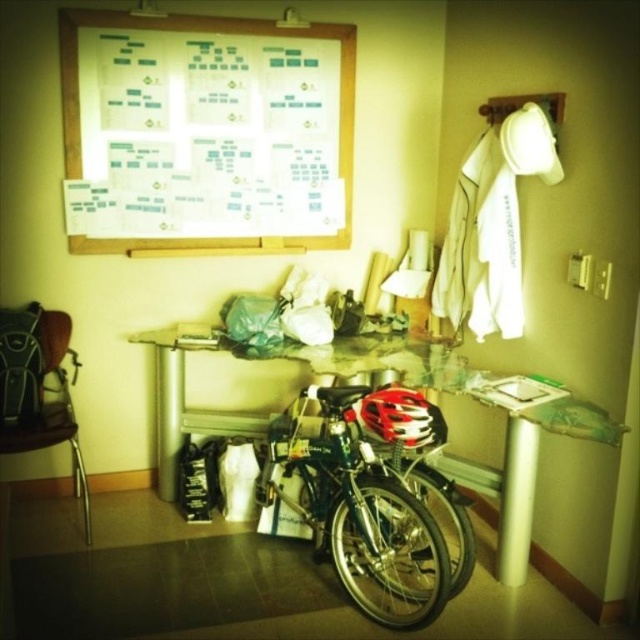
You are standing in the room and want to move the bicycle from its current position at point (358, 513) to a new location. Can you estimate whether the bicycle will fit in the space if you move it to the left by 0.2 units along the x and y axes?

The point (358, 513) corresponds to the shiny metallic bicycle at center. Moving it left by 0.2 units along the x and y axes would place it at coordinates 0.603, 0.362. Since the scene description mentions a cluttered indoor space with a table and other items, there might be obstacles in the new position. However, the exact dimensions of the space and obstacles aren not provided, so it is uncertain if the bicycle will fit.

You are trying to move a large box from the corner of the room to the opposite wall. The shiny metallic bicycle at center is in your way. Can you move the bicycle to the side without moving it more than 2 meters? Please explain your reasoning based on the room layout described.

The shiny metallic bicycle at center is located at point (358, 513). Since the room is small and cluttered, moving the bicycle more than 2 meters might not be feasible due to limited space and obstacles like the table and other items. However, the exact distance isn

You are trying to move the brown leather chair at left closer to the wall. The metallic silver table at center is in the way. Can you move the chair around the table to the left side?

The metallic silver table at center is positioned on the right side of brown leather chair at left, so moving the chair to the left side would require moving it around the table to the left, which should be possible as the table is to the right of the chair.